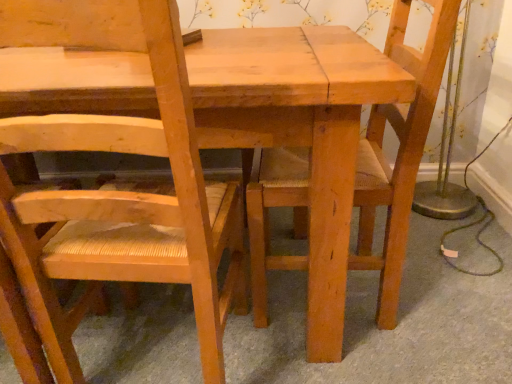
Identify the location of free space in front of natural wood chair at center, arranged as the 2th chair when viewed from the left. The height and width of the screenshot is (384, 512). (355, 352).